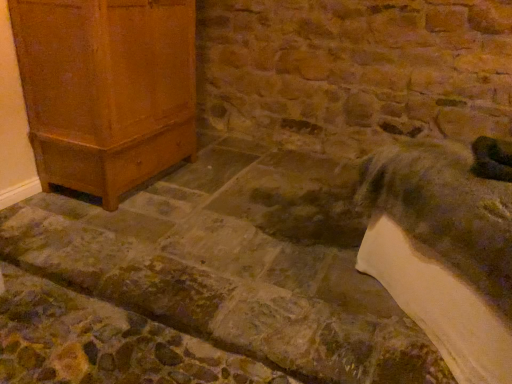
Question: Considering the positions of matte wood cabinet at left and green fuzzy animal at lower right in the image, is matte wood cabinet at left bigger or smaller than green fuzzy animal at lower right?

Choices:
 (A) big
 (B) small

Answer: (A)

Question: Considering the positions of matte wood cabinet at left and green fuzzy animal at lower right in the image, is matte wood cabinet at left wider or thinner than green fuzzy animal at lower right?

Choices:
 (A) wide
 (B) thin

Answer: (A)

Question: Is matte wood cabinet at left inside the boundaries of green fuzzy animal at lower right, or outside?

Choices:
 (A) outside
 (B) inside

Answer: (A)

Question: From the image's perspective, relative to matte wood cabinet at left, is green fuzzy animal at lower right above or below?

Choices:
 (A) above
 (B) below

Answer: (B)

Question: Considering the relative positions of green fuzzy animal at lower right and matte wood cabinet at left in the image provided, is green fuzzy animal at lower right to the left or to the right of matte wood cabinet at left?

Choices:
 (A) left
 (B) right

Answer: (B)

Question: Is green fuzzy animal at lower right inside the boundaries of matte wood cabinet at left, or outside?

Choices:
 (A) outside
 (B) inside

Answer: (A)

Question: Is green fuzzy animal at lower right wider or thinner than matte wood cabinet at left?

Choices:
 (A) wide
 (B) thin

Answer: (B)